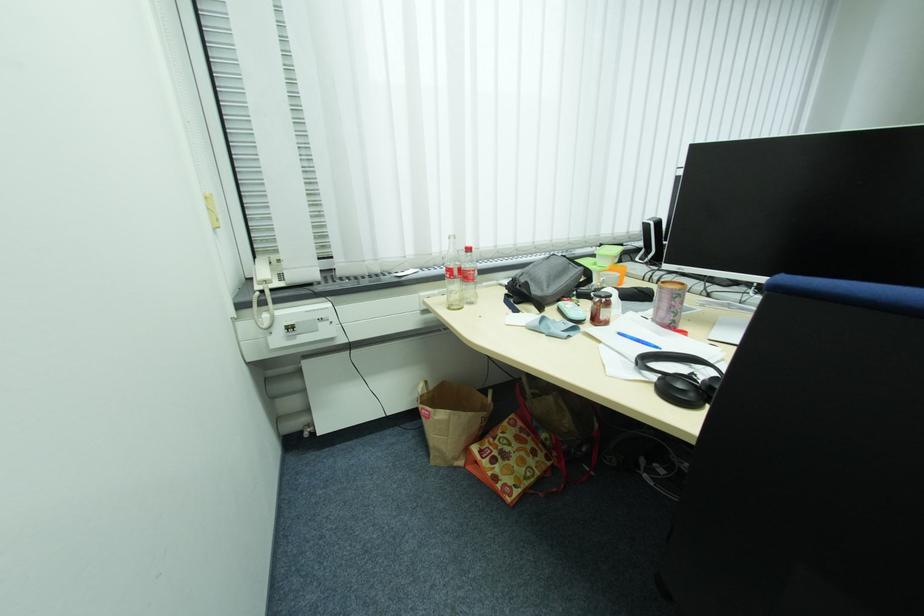
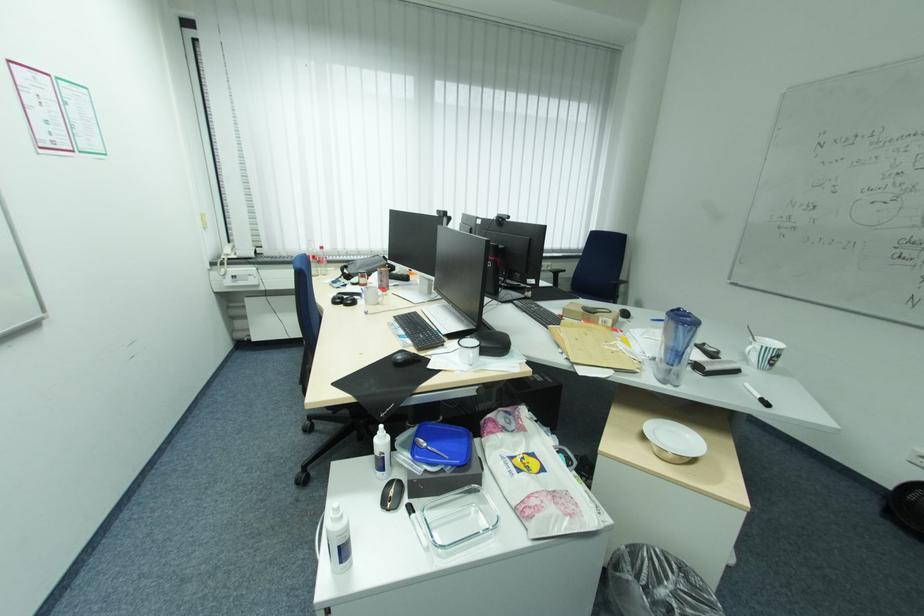
Question: I am providing you with two images of the same scene from different viewpoints. Which of the following objects are not visible in image2?

Choices:
 (A) pink slip-on shoe
 (B) striped mug handle
 (C) water filter handle
 (D) black headphones

Answer: (D)